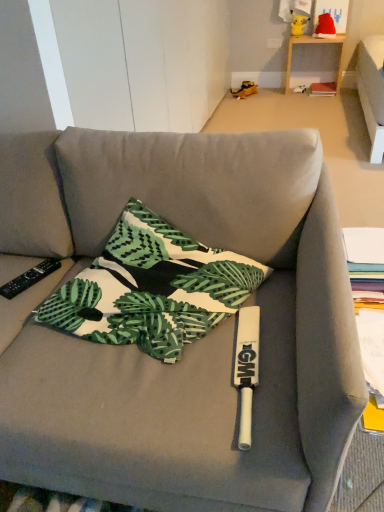
Question: Is green leaf-patterned fabric pillow at center with red fabric santa hat at upper right, the 2th toy in the left-to-right sequence?

Choices:
 (A) no
 (B) yes

Answer: (A)

Question: Does green leaf-patterned fabric pillow at center turn towards red fabric santa hat at upper right, the 2th toy in the left-to-right sequence?

Choices:
 (A) no
 (B) yes

Answer: (A)

Question: Does green leaf-patterned fabric pillow at center have a larger size compared to red fabric santa hat at upper right, the 2th toy in the left-to-right sequence?

Choices:
 (A) yes
 (B) no

Answer: (A)

Question: Can you confirm if green leaf-patterned fabric pillow at center is taller than red fabric santa hat at upper right, placed as the first toy when sorted from right to left?

Choices:
 (A) yes
 (B) no

Answer: (A)

Question: Considering the relative positions of green leaf-patterned fabric pillow at center and red fabric santa hat at upper right, placed as the first toy when sorted from right to left, in the image provided, is green leaf-patterned fabric pillow at center to the left of red fabric santa hat at upper right, placed as the first toy when sorted from right to left, from the viewer's perspective?

Choices:
 (A) no
 (B) yes

Answer: (B)

Question: Is red fabric santa hat at upper right, the 2th toy in the left-to-right sequence, spatially inside green leaf-patterned fabric pillow at center, or outside of it?

Choices:
 (A) inside
 (B) outside

Answer: (B)

Question: In the image, is red fabric santa hat at upper right, the 2th toy in the left-to-right sequence, on the left side or the right side of green leaf-patterned fabric pillow at center?

Choices:
 (A) right
 (B) left

Answer: (A)

Question: Is red fabric santa hat at upper right, the 2th toy in the left-to-right sequence, taller or shorter than green leaf-patterned fabric pillow at center?

Choices:
 (A) short
 (B) tall

Answer: (A)

Question: From a real-world perspective, relative to green leaf-patterned fabric pillow at center, is red fabric santa hat at upper right, the 2th toy in the left-to-right sequence, vertically above or below?

Choices:
 (A) above
 (B) below

Answer: (A)

Question: Considering their positions, is green leaf-patterned fabric pillow at center located in front of or behind wooden table at upper right?

Choices:
 (A) behind
 (B) front

Answer: (B)

Question: In terms of height, does green leaf-patterned fabric pillow at center look taller or shorter compared to wooden table at upper right?

Choices:
 (A) tall
 (B) short

Answer: (B)

Question: From a real-world perspective, is green leaf-patterned fabric pillow at center above or below wooden table at upper right?

Choices:
 (A) below
 (B) above

Answer: (B)

Question: Is green leaf-patterned fabric pillow at center bigger or smaller than wooden table at upper right?

Choices:
 (A) big
 (B) small

Answer: (B)

Question: In terms of size, does wooden table at upper right appear bigger or smaller than yellow plush toy at upper center, the 1th toy when ordered from left to right?

Choices:
 (A) big
 (B) small

Answer: (A)

Question: From the image's perspective, is wooden table at upper right located above or below yellow plush toy at upper center, the 1th toy when ordered from left to right?

Choices:
 (A) below
 (B) above

Answer: (A)